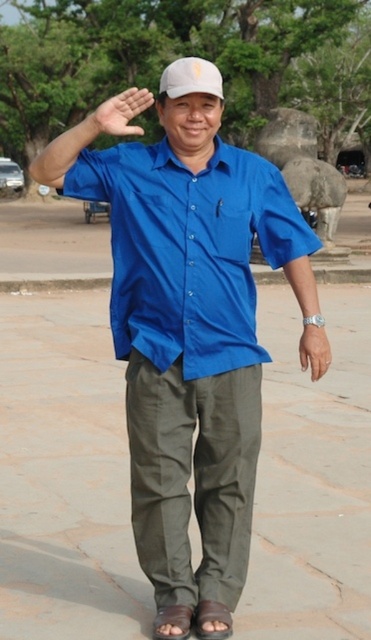
Question: Is matte blue shirt at center to the right of white matte baseball hat at center from the viewer's perspective?

Choices:
 (A) yes
 (B) no

Answer: (A)

Question: Which of these objects is positioned closest to the matte blue shirt at center?

Choices:
 (A) blue cotton shirt at center
 (B) olive green cotton pants at center
 (C) smooth skin hand at center
 (D) white matte baseball hat at center

Answer: (A)

Question: Where is blue cotton shirt at center located in relation to matte blue shirt at center in the image?

Choices:
 (A) right
 (B) left

Answer: (B)

Question: Is smooth skin hand at center thinner than matte brown wristwatch at lower right?

Choices:
 (A) yes
 (B) no

Answer: (B)

Question: Which of the following is the farthest from the observer?

Choices:
 (A) (303, 353)
 (B) (139, 496)
 (C) (171, 61)

Answer: (C)

Question: Which is farther from the matte brown wristwatch at lower right?

Choices:
 (A) white matte baseball hat at center
 (B) smooth skin hand at center

Answer: (B)